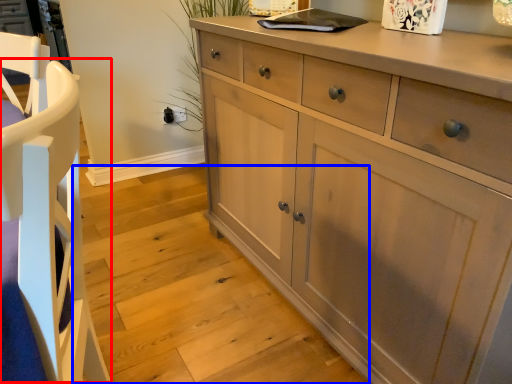
Question: Which of the following is the closest to the observer, armchair (highlighted by a red box) or stair (highlighted by a blue box)?

Choices:
 (A) armchair
 (B) stair

Answer: (A)